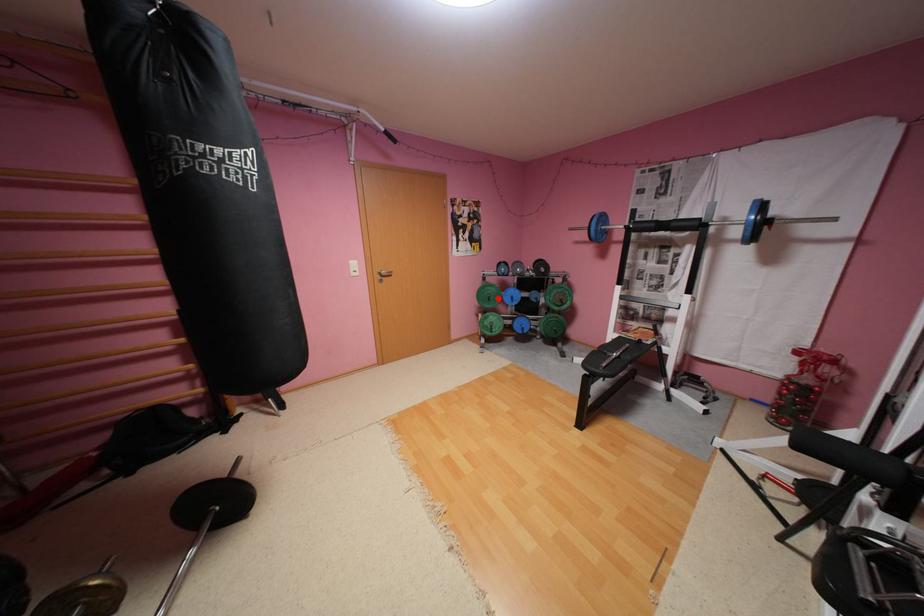
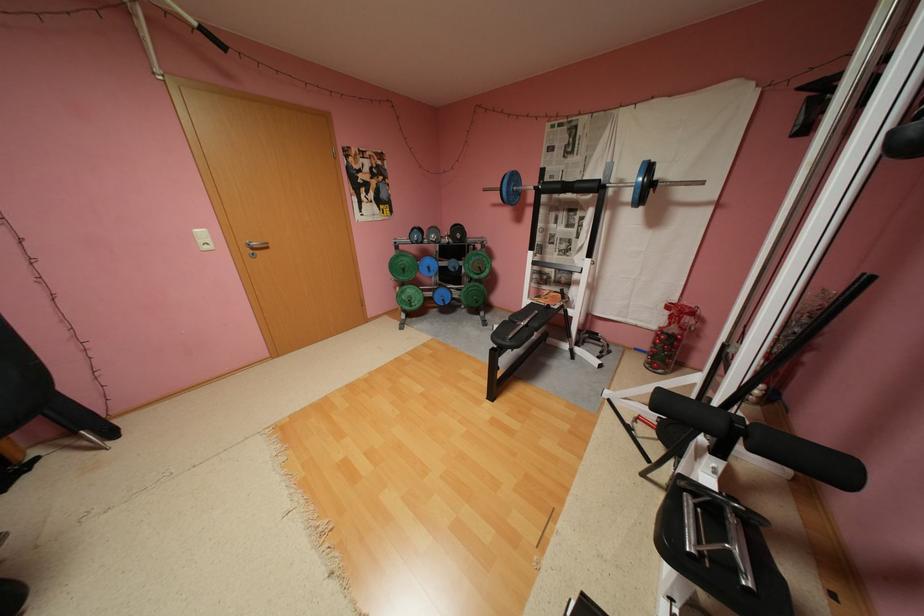
Question: I am providing you with two images of the same scene from different viewpoints. Given a red point in image1, look at the same physical point in image2. Is it:

Choices:
 (A) Closer to the viewpoint
 (B) Farther from the viewpoint

Answer: (A)